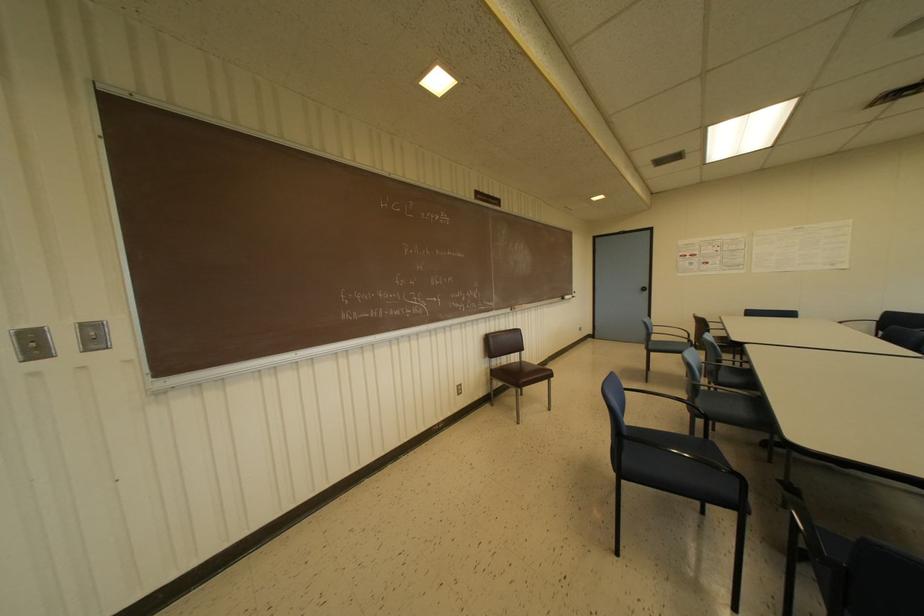
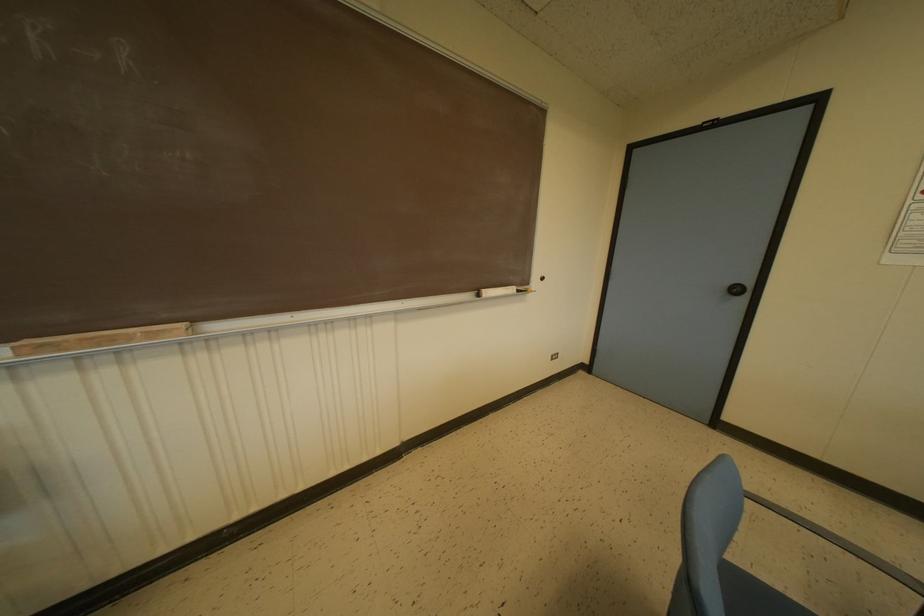
The images are taken continuously from a first-person perspective. In which direction are you moving?

The cameraman walked toward right, forward.